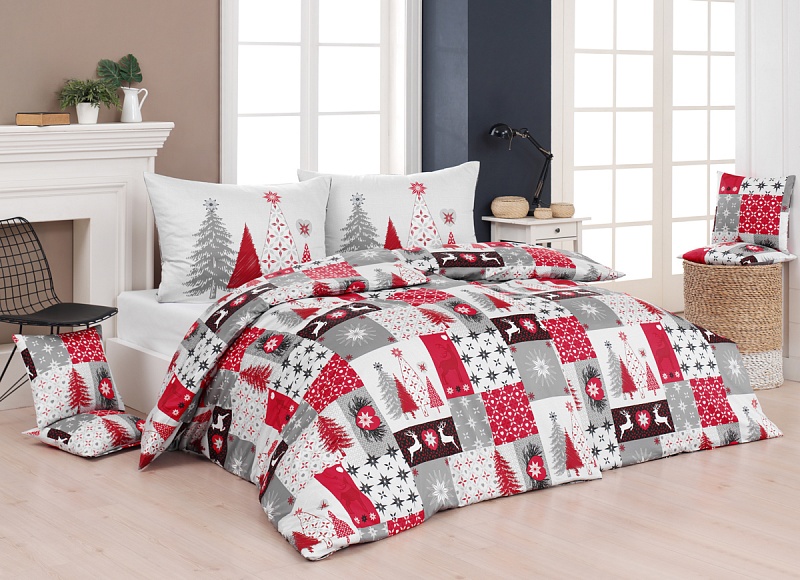
The width and height of the screenshot is (800, 580). Find the location of `bed comforter`. bed comforter is located at coordinates (370, 324).